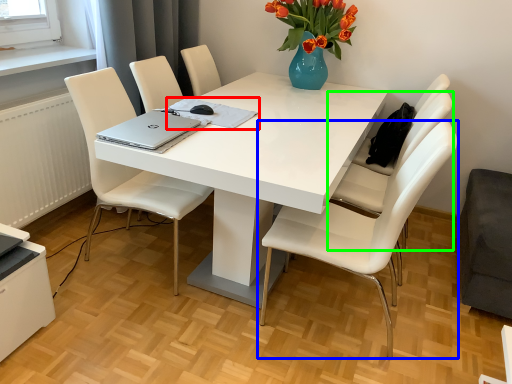
Question: Considering the real-world distances, which object is farthest from notebook (highlighted by a red box)? chair (highlighted by a blue box) or chair (highlighted by a green box)?

Choices:
 (A) chair
 (B) chair

Answer: (B)